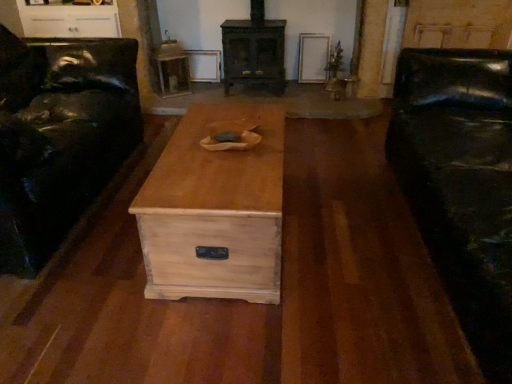
The height and width of the screenshot is (384, 512). I want to click on unoccupied region to the right of natural wood chest at center, so click(x=345, y=231).